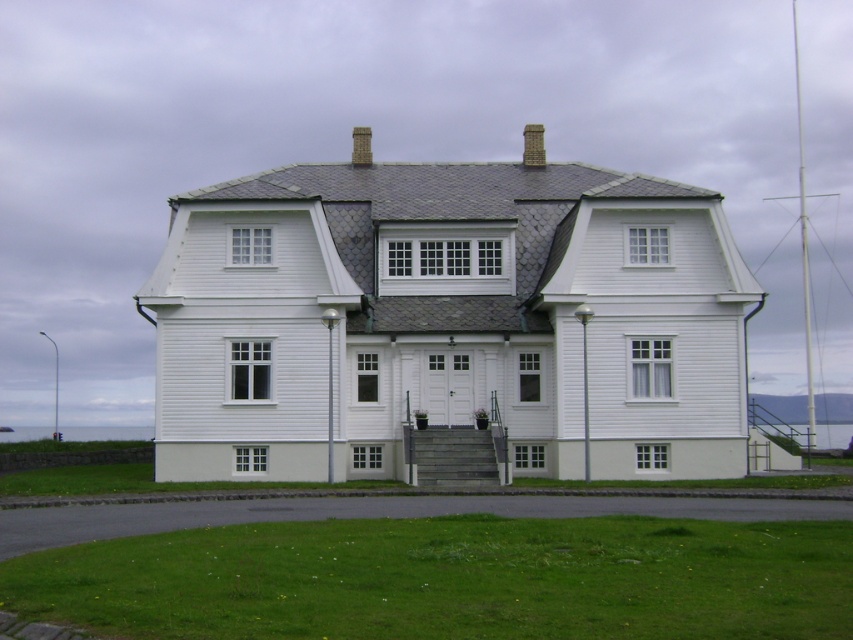
Question: Is gray stone chimney at center below brown brick chimney at upper center?

Choices:
 (A) no
 (B) yes

Answer: (B)

Question: Which of the following is the farthest from the observer?

Choices:
 (A) gray stone chimney at center
 (B) brown brick chimney at upper center

Answer: (B)

Question: Does gray stone chimney at center appear under brown brick chimney at upper center?

Choices:
 (A) no
 (B) yes

Answer: (B)

Question: Considering the relative positions of gray stone chimney at center and brown brick chimney at upper center in the image provided, where is gray stone chimney at center located with respect to brown brick chimney at upper center?

Choices:
 (A) below
 (B) above

Answer: (A)

Question: Which point appears closest to the camera in this image?

Choices:
 (A) (370, 342)
 (B) (358, 129)

Answer: (A)